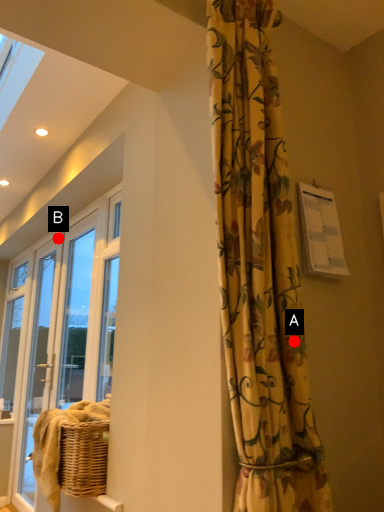
Question: Two points are circled on the image, labeled by A and B beside each circle. Which of the following is the farthest from the observer?

Choices:
 (A) A is further
 (B) B is further

Answer: (B)